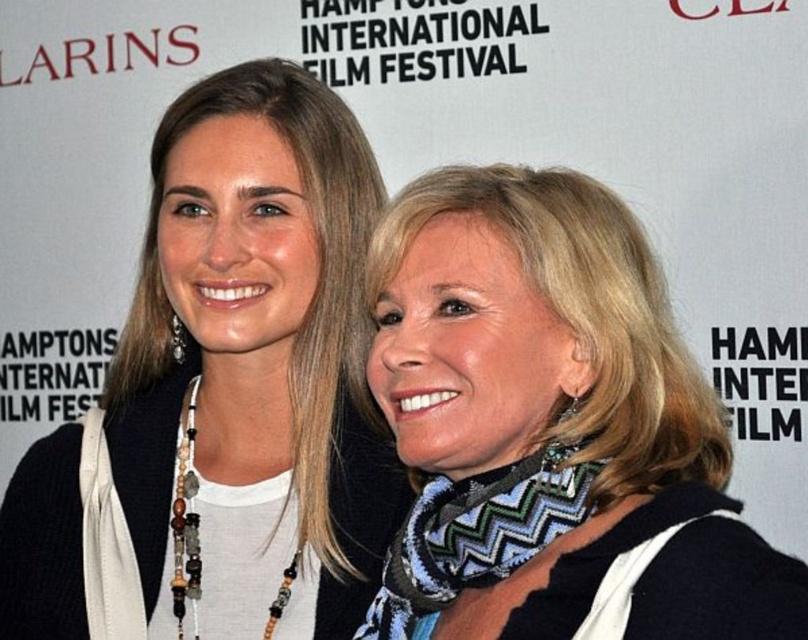
You are a photographer at the Hamptons International Film Festival. You need to position two lights for a portrait. The first light should be placed at point (238,412) and the second at point (484,394). Which light is closer to the camera?

Point (238,412) is behind point (484,394), so the second light at point (484,394) is closer to the camera.

You are a photographer at the Hamptons International Film Festival. You want to place a matte black scarf at upper center in the image. Where should you place it?

Place the matte black scarf at upper center at the coordinates point [222,396].